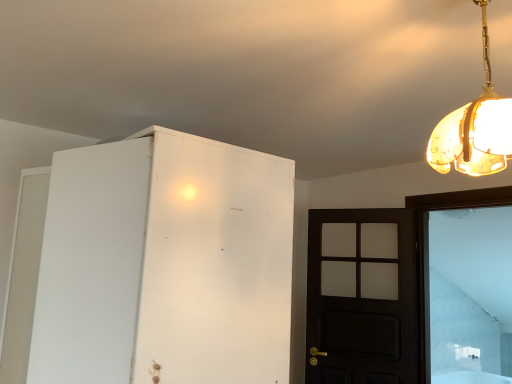
Question: From a real-world perspective, is white matte cabinet at left located higher than translucent amber glass pendant light at upper right?

Choices:
 (A) no
 (B) yes

Answer: (A)

Question: Does white matte cabinet at left have a lesser height compared to translucent amber glass pendant light at upper right?

Choices:
 (A) yes
 (B) no

Answer: (B)

Question: Is white matte cabinet at left at the left side of translucent amber glass pendant light at upper right?

Choices:
 (A) no
 (B) yes

Answer: (B)

Question: Are white matte cabinet at left and translucent amber glass pendant light at upper right far apart?

Choices:
 (A) no
 (B) yes

Answer: (A)

Question: Is white matte cabinet at left completely or partially outside of translucent amber glass pendant light at upper right?

Choices:
 (A) no
 (B) yes

Answer: (B)

Question: Considering the relative sizes of white matte cabinet at left and translucent amber glass pendant light at upper right in the image provided, is white matte cabinet at left thinner than translucent amber glass pendant light at upper right?

Choices:
 (A) no
 (B) yes

Answer: (A)

Question: Are dark wood door at right and white matte cabinet at left located far from each other?

Choices:
 (A) no
 (B) yes

Answer: (B)

Question: Is dark wood door at right directly adjacent to white matte cabinet at left?

Choices:
 (A) no
 (B) yes

Answer: (A)

Question: Considering the relative positions of dark wood door at right and white matte cabinet at left in the image provided, is dark wood door at right to the right of white matte cabinet at left from the viewer's perspective?

Choices:
 (A) no
 (B) yes

Answer: (B)

Question: Is dark wood door at right closer to the viewer compared to white matte cabinet at left?

Choices:
 (A) yes
 (B) no

Answer: (B)

Question: From a real-world perspective, is dark wood door at right physically below white matte cabinet at left?

Choices:
 (A) yes
 (B) no

Answer: (A)

Question: From the image's perspective, is dark wood door at right on white matte cabinet at left?

Choices:
 (A) yes
 (B) no

Answer: (B)

Question: From a real-world perspective, is white glass door at right located beneath dark wood door at right?

Choices:
 (A) yes
 (B) no

Answer: (B)